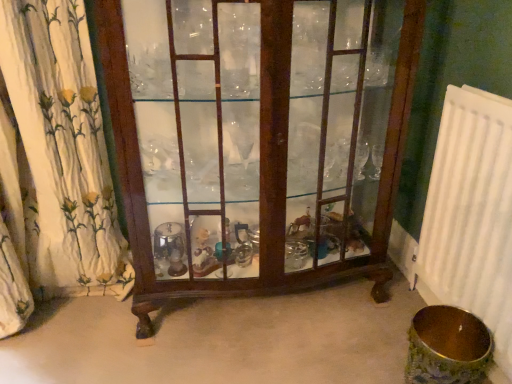
This screenshot has height=384, width=512. What do you see at coordinates (58, 155) in the screenshot? I see `white floral fabric at left` at bounding box center [58, 155].

What do you see at coordinates (471, 217) in the screenshot?
I see `white plastic radiator at right` at bounding box center [471, 217].

Find the location of a particular element. The image size is (512, 384). white floral fabric at left is located at coordinates (58, 155).

Is mahogany glass cabinet at center wider than white floral fabric at left?

Correct, the width of mahogany glass cabinet at center exceeds that of white floral fabric at left.

From a real-world perspective, is mahogany glass cabinet at center below white floral fabric at left?

Yes, from a real-world perspective, mahogany glass cabinet at center is below white floral fabric at left.

Is mahogany glass cabinet at center far from white floral fabric at left?

mahogany glass cabinet at center is near white floral fabric at left, not far away.

Which of these two, white plastic radiator at right or white floral fabric at left, is thinner?

With smaller width is white plastic radiator at right.

Does point (499, 301) come behind point (49, 184)?

No, (499, 301) is in front of (49, 184).

From a real-world perspective, is white plastic radiator at right above or below white floral fabric at left?

white plastic radiator at right is situated lower than white floral fabric at left in the real world.

Is white plastic radiator at right not close to white floral fabric at left?

Yes, white plastic radiator at right and white floral fabric at left are located far from each other.

I want to click on radiator located in front of the mahogany glass cabinet at center, so click(471, 217).

How much distance is there between white plastic radiator at right and mahogany glass cabinet at center?

A distance of 19.06 inches exists between white plastic radiator at right and mahogany glass cabinet at center.

Consider the image. Is white plastic radiator at right wider or thinner than mahogany glass cabinet at center?

Clearly, white plastic radiator at right has less width compared to mahogany glass cabinet at center.

From a real-world perspective, between white plastic radiator at right and mahogany glass cabinet at center, who is vertically higher?

mahogany glass cabinet at center.

Locate an element on the screen. curtain above the mahogany glass cabinet at center (from a real-world perspective) is located at coordinates pyautogui.click(x=58, y=155).

Does point (82, 265) lie in front of point (256, 7)?

No, it is not.

Can you confirm if white floral fabric at left is bigger than mahogany glass cabinet at center?

Actually, white floral fabric at left might be smaller than mahogany glass cabinet at center.

Is the surface of white floral fabric at left in direct contact with mahogany glass cabinet at center?

No, white floral fabric at left is not next to mahogany glass cabinet at center.

From a real-world perspective, is mahogany glass cabinet at center located higher than white plastic radiator at right?

Yes.

Which is behind, mahogany glass cabinet at center or white plastic radiator at right?

mahogany glass cabinet at center is behind.

Based on the photo, does mahogany glass cabinet at center have a lesser width compared to white plastic radiator at right?

No, mahogany glass cabinet at center is not thinner than white plastic radiator at right.

From the image's perspective, is white floral fabric at left below white plastic radiator at right?

No, from the image's perspective, white floral fabric at left is not beneath white plastic radiator at right.

Find the location of a particular element. radiator below the white floral fabric at left (from the image's perspective) is located at coordinates (471, 217).

Which of these two, white floral fabric at left or white plastic radiator at right, is wider?

white floral fabric at left.

From a real-world perspective, is white floral fabric at left physically above white plastic radiator at right?

Yes, from a real-world perspective, white floral fabric at left is above white plastic radiator at right.

This screenshot has width=512, height=384. Identify the location of curtain lying on the left of mahogany glass cabinet at center. [58, 155].

At what (x,y) coordinates should I click in order to perform the action: click on radiator that is on the right side of white floral fabric at left. Please return your answer as a coordinate pair (x, y). The height and width of the screenshot is (384, 512). Looking at the image, I should click on (471, 217).

When comparing their distances from white floral fabric at left, does mahogany glass cabinet at center or white plastic radiator at right seem closer?

Based on the image, mahogany glass cabinet at center appears to be nearer to white floral fabric at left.

Considering their positions, is mahogany glass cabinet at center positioned further to white plastic radiator at right than white floral fabric at left?

white floral fabric at left.

When comparing their distances from white floral fabric at left, does white plastic radiator at right or mahogany glass cabinet at center seem further?

Based on the image, white plastic radiator at right appears to be further to white floral fabric at left.

Based on their spatial positions, is white floral fabric at left or mahogany glass cabinet at center further from white plastic radiator at right?

The object further to white plastic radiator at right is white floral fabric at left.

When comparing their distances from mahogany glass cabinet at center, does white floral fabric at left or white plastic radiator at right seem closer?

white floral fabric at left is closer to mahogany glass cabinet at center.

Which object lies nearer to the anchor point mahogany glass cabinet at center, white plastic radiator at right or white floral fabric at left?

white floral fabric at left is closer to mahogany glass cabinet at center.

Where is `furniture situated between white floral fabric at left and white plastic radiator at right from left to right`? This screenshot has width=512, height=384. furniture situated between white floral fabric at left and white plastic radiator at right from left to right is located at coordinates (257, 140).